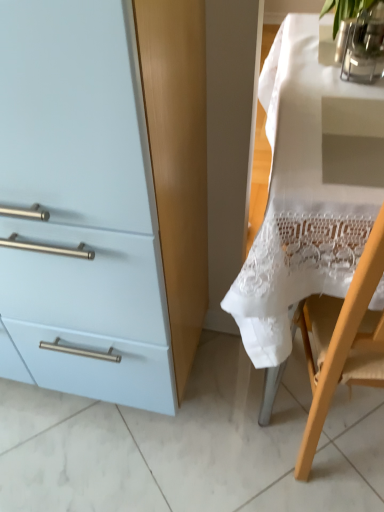
I want to click on unoccupied area in front of clear glass vase at upper right, which is counted as the 1th glass vase, starting from the front, so click(x=350, y=106).